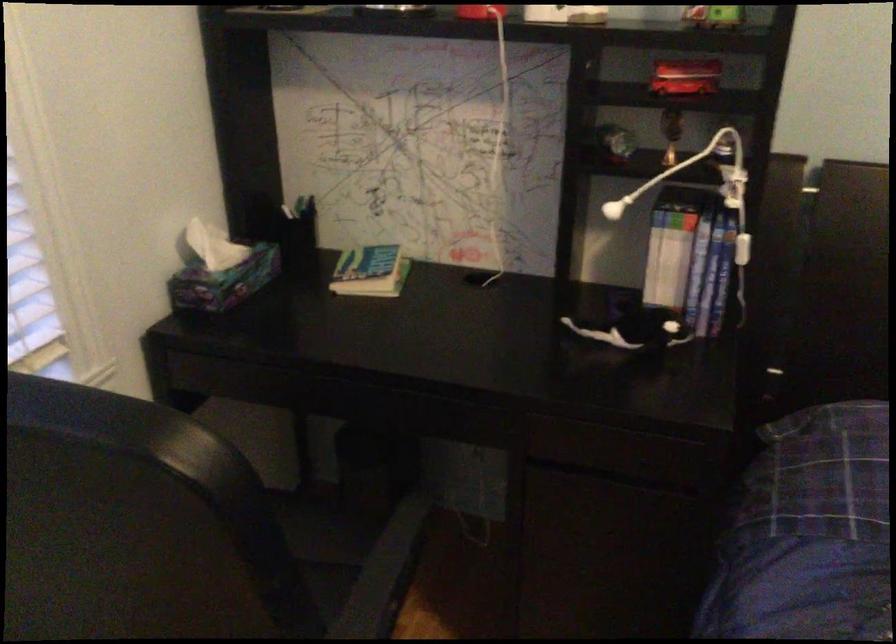
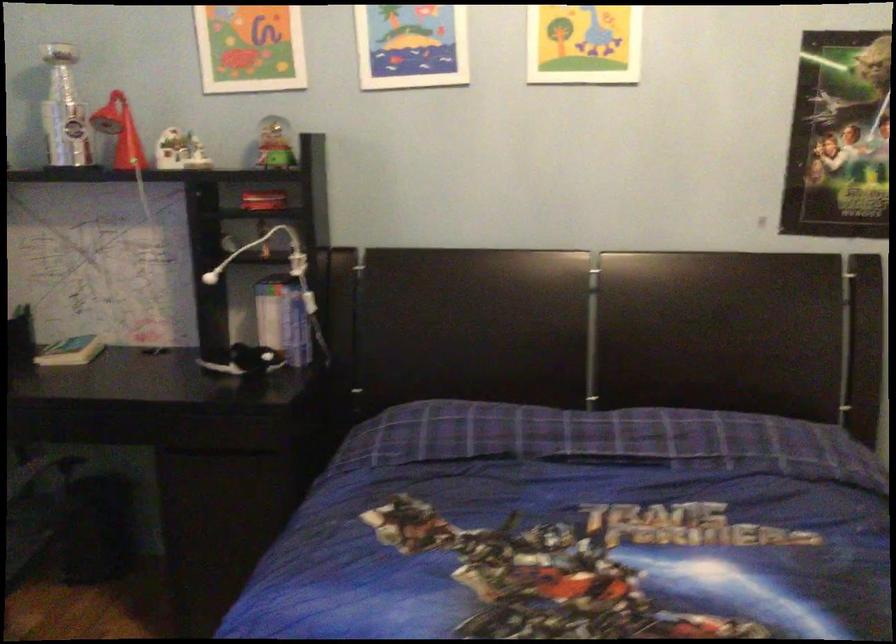
Question: The first image is from the beginning of the video and the second image is from the end. How did the camera likely rotate when shooting the video?

Choices:
 (A) Left
 (B) Right
 (C) Up
 (D) Down

Answer: (C)